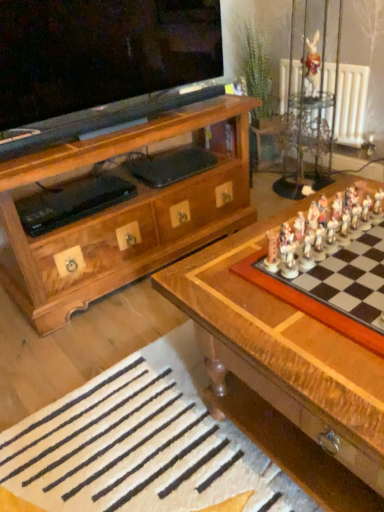
Question: Is clear glass vase at upper right not within wooden chessboard at center?

Choices:
 (A) no
 (B) yes

Answer: (B)

Question: Is clear glass vase at upper right turned away from wooden chessboard at center?

Choices:
 (A) yes
 (B) no

Answer: (B)

Question: Is clear glass vase at upper right at the right side of wooden chessboard at center?

Choices:
 (A) yes
 (B) no

Answer: (A)

Question: Can you confirm if clear glass vase at upper right is smaller than wooden chessboard at center?

Choices:
 (A) no
 (B) yes

Answer: (B)

Question: Is the position of clear glass vase at upper right more distant than that of wooden chessboard at center?

Choices:
 (A) no
 (B) yes

Answer: (B)

Question: Is clear glass vase at upper right surrounding wooden chessboard at center?

Choices:
 (A) yes
 (B) no

Answer: (B)

Question: Is the depth of white painted radiator at upper right greater than that of wooden chessboard at right?

Choices:
 (A) yes
 (B) no

Answer: (A)

Question: From a real-world perspective, is white painted radiator at upper right located beneath wooden chessboard at right?

Choices:
 (A) no
 (B) yes

Answer: (B)

Question: Is white painted radiator at upper right taller than wooden chessboard at right?

Choices:
 (A) yes
 (B) no

Answer: (A)

Question: Can you confirm if white painted radiator at upper right is smaller than wooden chessboard at right?

Choices:
 (A) no
 (B) yes

Answer: (A)

Question: Considering the relative sizes of white painted radiator at upper right and wooden chessboard at right in the image provided, is white painted radiator at upper right thinner than wooden chessboard at right?

Choices:
 (A) yes
 (B) no

Answer: (A)

Question: Is white painted radiator at upper right facing away from wooden chessboard at right?

Choices:
 (A) no
 (B) yes

Answer: (A)

Question: Can you confirm if white painted radiator at upper right is positioned to the left of wooden chessboard at center?

Choices:
 (A) no
 (B) yes

Answer: (A)